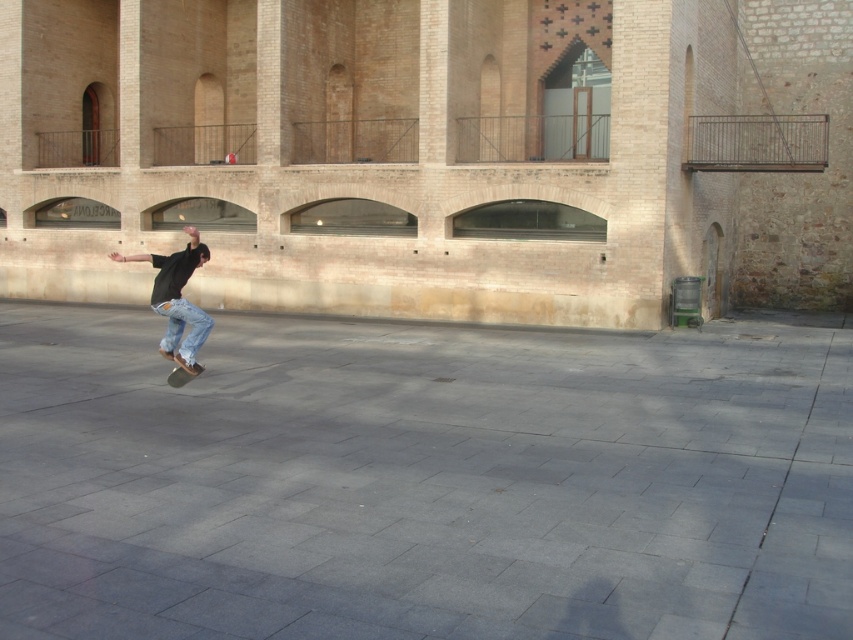
Which is behind, point (569, 412) or point (196, 369)?

The point (196, 369) is behind.

Which is more to the right, gray concrete pavement at center or black smooth skateboard at center?

gray concrete pavement at center

Where is `gray concrete pavement at center`? The width and height of the screenshot is (853, 640). gray concrete pavement at center is located at coordinates click(422, 481).

Measure the distance between point (636, 602) and camera.

The distance of point (636, 602) from camera is 14.80 feet.

Who is more forward, (355, 490) or (192, 250)?

Point (355, 490)

Does point (755, 332) come closer to viewer compared to point (189, 250)?

No, it is not.

In order to click on gray concrete pavement at center in this screenshot , I will do `click(422, 481)`.

In the scene shown: Is denim jeans at center bigger than black smooth skateboard at center?

Correct, denim jeans at center is larger in size than black smooth skateboard at center.

Can you confirm if denim jeans at center is positioned above black smooth skateboard at center?

Yes.

Does point (172, 301) come in front of point (190, 374)?

Yes, point (172, 301) is closer to viewer.

You are a GUI agent. You are given a task and a screenshot of the screen. Output one action in this format:
    pyautogui.click(x=<x>, y=<y>)
    Task: Click on the denim jeans at center
    The height and width of the screenshot is (640, 853).
    Given the screenshot: What is the action you would take?
    pyautogui.click(x=177, y=300)